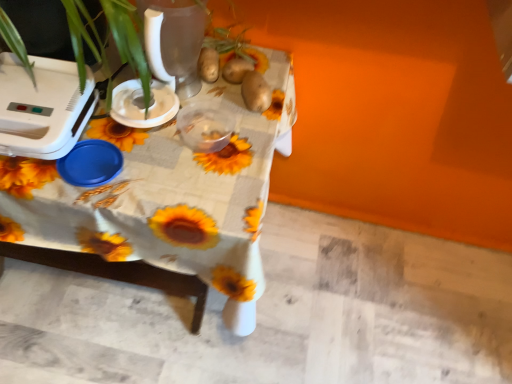
This screenshot has width=512, height=384. What are the coordinates of `vacant area that lies in front of white plastic blender at upper left, which appears as the first appliance when viewed from the right` in the screenshot? It's located at (128, 167).